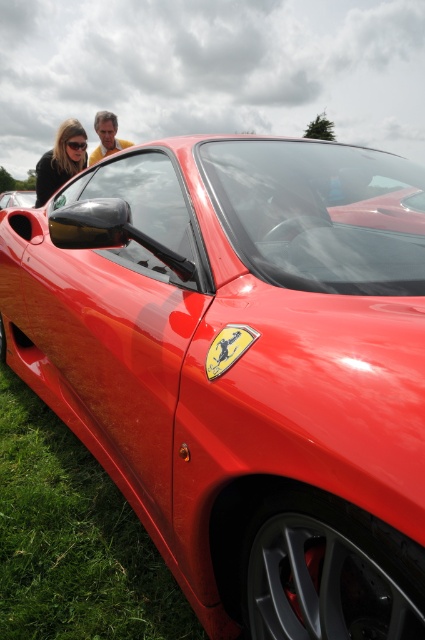
You are a photographer trying to capture the Ferrari sports car. You notice the green grass at lower left and the matte black sunglasses at upper left in your frame. Which object is wider in the image?

The green grass at lower left is wider than the matte black sunglasses at upper left according to the description.